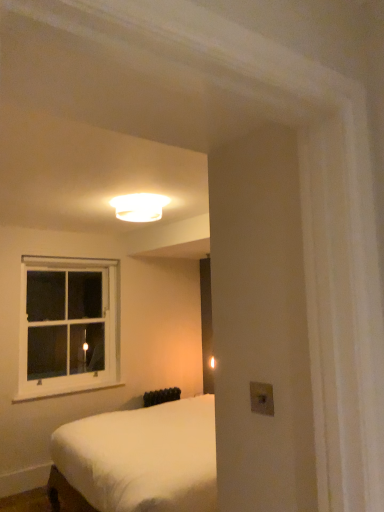
Question: Should I look upward or downward to see black matte radiator at lower center?

Choices:
 (A) down
 (B) up

Answer: (A)

Question: Would you say white wooden window at upper left is part of black matte radiator at lower center's contents?

Choices:
 (A) yes
 (B) no

Answer: (B)

Question: From a real-world perspective, is black matte radiator at lower center located beneath white wooden window at upper left?

Choices:
 (A) yes
 (B) no

Answer: (A)

Question: From the image's perspective, is black matte radiator at lower center beneath white wooden window at upper left?

Choices:
 (A) no
 (B) yes

Answer: (B)

Question: Does black matte radiator at lower center appear on the left side of white wooden window at upper left?

Choices:
 (A) no
 (B) yes

Answer: (A)

Question: Considering the relative sizes of black matte radiator at lower center and white wooden window at upper left in the image provided, is black matte radiator at lower center thinner than white wooden window at upper left?

Choices:
 (A) yes
 (B) no

Answer: (A)

Question: Is black matte radiator at lower center positioned in front of white wooden window at upper left?

Choices:
 (A) no
 (B) yes

Answer: (A)

Question: Is white painted wood at lower left bigger than white wooden window at upper left?

Choices:
 (A) yes
 (B) no

Answer: (B)

Question: Is white painted wood at lower left not within white wooden window at upper left?

Choices:
 (A) no
 (B) yes

Answer: (B)

Question: From a real-world perspective, is white painted wood at lower left on top of white wooden window at upper left?

Choices:
 (A) no
 (B) yes

Answer: (A)

Question: Would you consider white painted wood at lower left to be distant from white wooden window at upper left?

Choices:
 (A) no
 (B) yes

Answer: (A)

Question: Can you confirm if white painted wood at lower left is positioned to the left of white wooden window at upper left?

Choices:
 (A) no
 (B) yes

Answer: (A)

Question: Is white wooden window at upper left surrounded by white painted wood at lower left?

Choices:
 (A) yes
 (B) no

Answer: (B)

Question: Are white painted wood at lower left and white glossy ceiling light at upper center far apart?

Choices:
 (A) no
 (B) yes

Answer: (B)